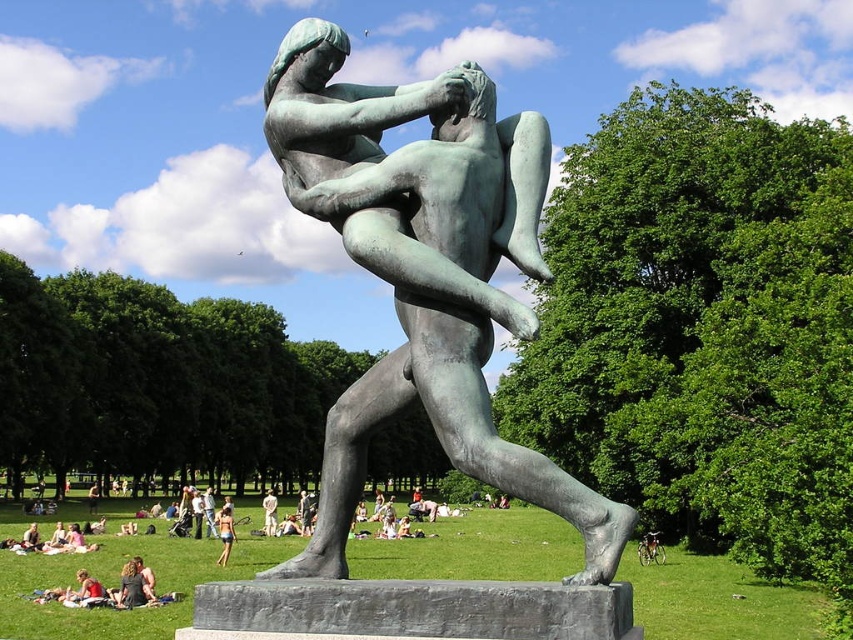
Question: Which object is the farthest from the matte bronze statue at center?

Choices:
 (A) green patina bronze statue at center
 (B) light brown wood man at center
 (C) matte black dress at lower left

Answer: (A)

Question: Estimate the real-world distances between objects in this image. Which object is farther from the light brown hair at center?

Choices:
 (A) matte bronze statue at center
 (B) matte black dress at lower left
 (C) green patina bronze statue at center
 (D) light brown wood man at center

Answer: (C)

Question: Does matte black dress at lower left have a greater width compared to light brown wood man at center?

Choices:
 (A) yes
 (B) no

Answer: (B)

Question: Considering the relative positions of matte black dress at lower left and light brown hair at center in the image provided, where is matte black dress at lower left located with respect to light brown hair at center?

Choices:
 (A) right
 (B) left

Answer: (A)

Question: Can you confirm if matte black dress at lower left is positioned to the left of matte bronze statue at center?

Choices:
 (A) no
 (B) yes

Answer: (A)

Question: Which point is closer to the camera?

Choices:
 (A) light brown wood man at center
 (B) green patina bronze statue at center

Answer: (B)